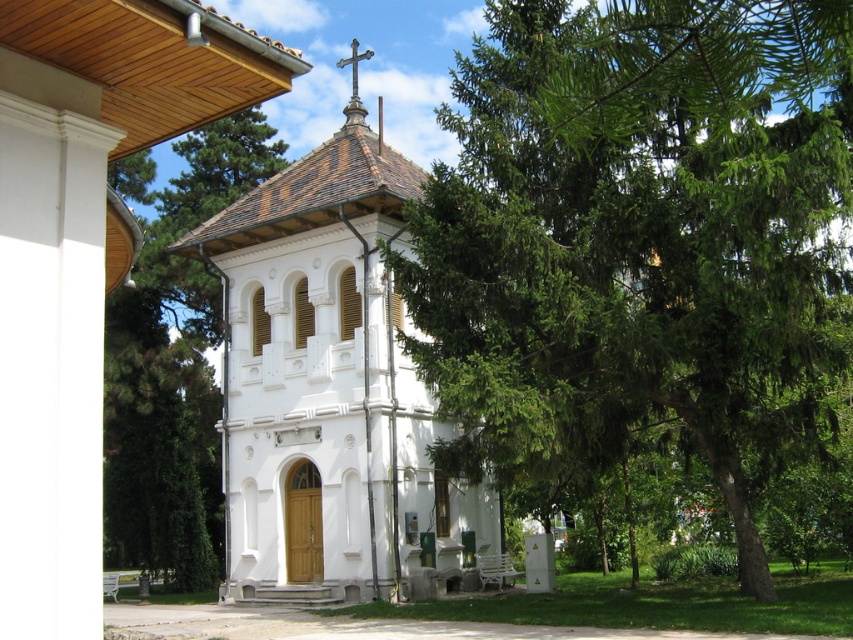
You are standing at the entrance of the white two story building and want to walk to the green leafy tree at center. Which direction should you walk?

The green leafy tree at center is located at point (640, 241), so you should walk towards the center of the image to reach it.

You are standing at the entrance of the white painted wood chapel at center and want to admire the green leafy tree at center. In which direction should you look relative to the chapel to see the tree?

The green leafy tree at center is below the white painted wood chapel at center, so you should look downward from the chapel to see the tree.

You are standing at the entrance of the white two story building with a cross on the roof and looking towards the paved pathway. There is a point marked at coordinate (640, 241). What object is located at that point?

The point at coordinate (640, 241) corresponds to the green leafy tree at center.